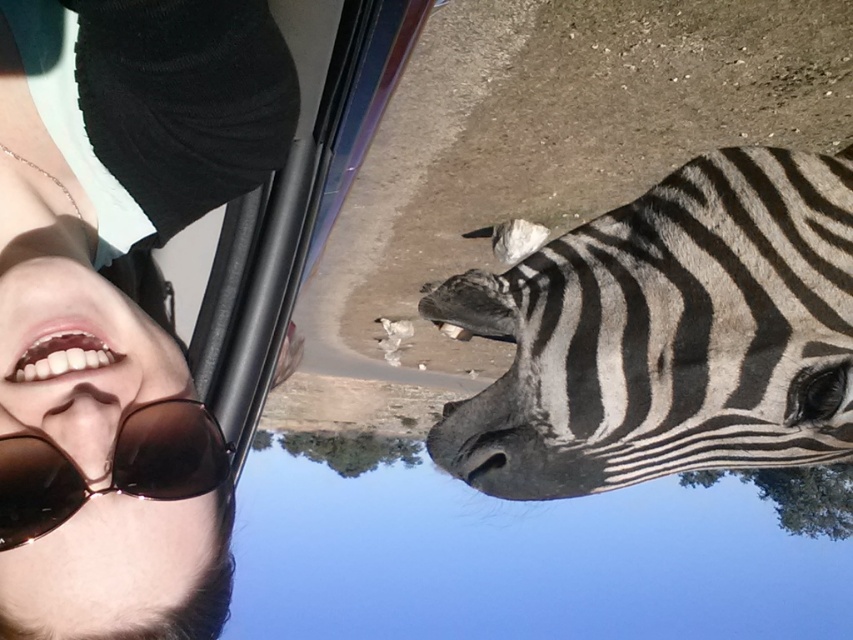
Question: Which point is farther to the camera?

Choices:
 (A) matte brown nose at lower left
 (B) black and white striped zebra at center

Answer: (B)

Question: Which object is the closest to the black and white striped zebra at center?

Choices:
 (A) matte brown nose at lower left
 (B) brown matte goggles at lower left

Answer: (B)

Question: Is brown matte goggles at lower left behind matte brown nose at lower left?

Choices:
 (A) yes
 (B) no

Answer: (B)

Question: Is black and white striped zebra at center to the right of matte brown nose at lower left from the viewer's perspective?

Choices:
 (A) yes
 (B) no

Answer: (A)

Question: Can you confirm if black and white striped zebra at center is positioned above brown matte goggles at lower left?

Choices:
 (A) no
 (B) yes

Answer: (B)

Question: Which point is closer to the camera?

Choices:
 (A) brown matte goggles at lower left
 (B) matte brown nose at lower left
 (C) black and white striped zebra at center

Answer: (A)